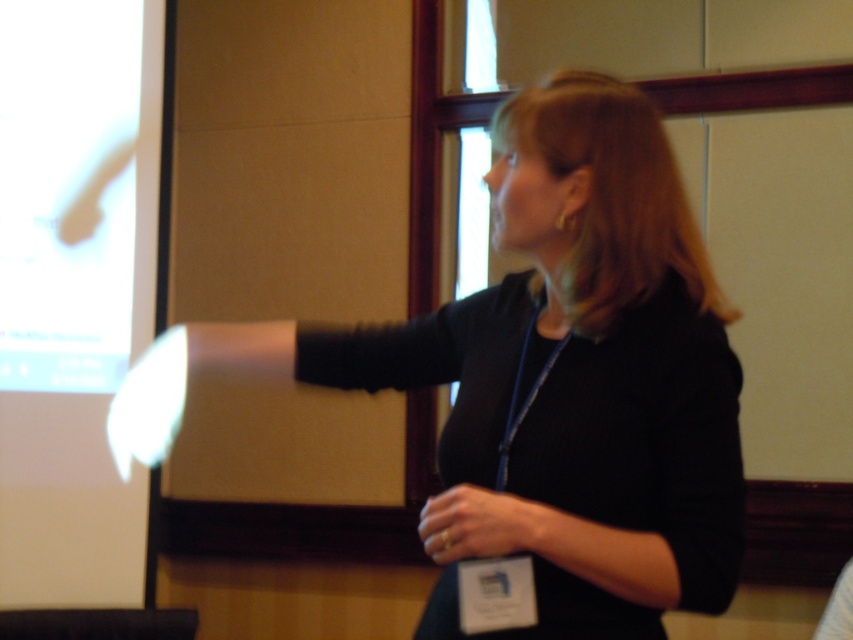
Is white glossy projection screen at left smaller than gold ring at center?

No.

Between white glossy projection screen at left and gold ring at center, which one is positioned higher?

white glossy projection screen at left is higher up.

Which is in front, point (103, 336) or point (438, 556)?

Point (438, 556) is more forward.

Find the location of a particular element. This screenshot has height=640, width=853. white glossy projection screen at left is located at coordinates (74, 289).

Is black matte shirt at center above white glossy projection screen at left?

No, black matte shirt at center is not above white glossy projection screen at left.

Is point (637, 266) less distant than point (107, 51)?

Yes, point (637, 266) is closer to viewer.

What do you see at coordinates (572, 365) in the screenshot? The height and width of the screenshot is (640, 853). I see `black matte shirt at center` at bounding box center [572, 365].

Find the location of a particular element. black matte shirt at center is located at coordinates (572, 365).

Between point (672, 525) and point (453, 490), which one is positioned in front?

Point (672, 525) is in front.

Which of these two, black matte shirt at center or gold ring at center, stands taller?

black matte shirt at center is taller.

Where is `black matte shirt at center`? black matte shirt at center is located at coordinates (572, 365).

Find the location of a particular element. The height and width of the screenshot is (640, 853). black matte shirt at center is located at coordinates (572, 365).